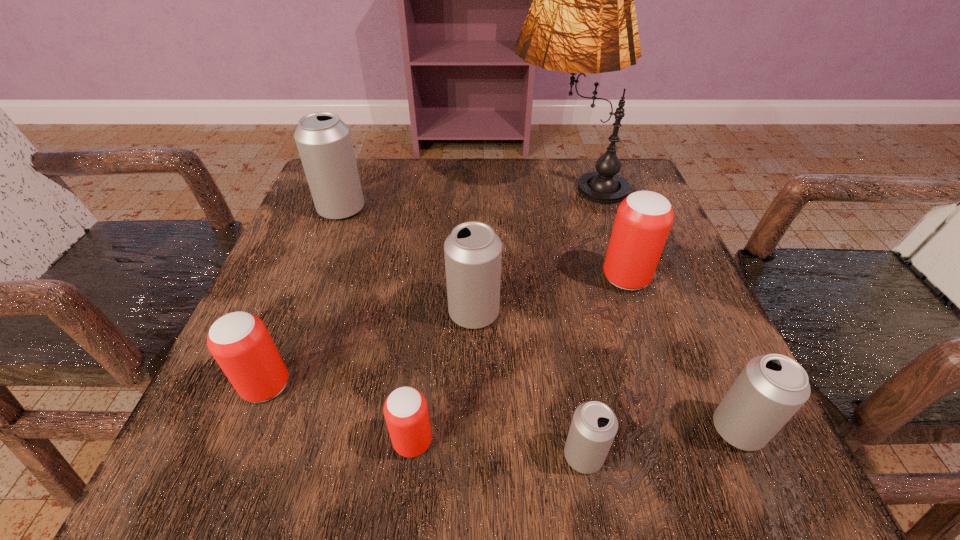
The image size is (960, 540). Find the location of `lampshade`. lampshade is located at coordinates (582, 19).

Where is `the seventh shortest object`? This screenshot has width=960, height=540. the seventh shortest object is located at coordinates (324, 143).

Identify the location of the leftmost white beer can. (324, 143).

I want to click on the farthest red beer can, so click(643, 220).

Identify the location of the second beer can from right to left. The height and width of the screenshot is (540, 960). (643, 220).

The image size is (960, 540). Identify the location of the fourth beer can from left to right. (473, 252).

Locate an element on the screen. The image size is (960, 540). the fourth object from left to right is located at coordinates (473, 252).

At what (x,y) coordinates should I click in order to perform the action: click on the second farthest red beer can. Please return your answer as a coordinate pair (x, y). This screenshot has width=960, height=540. Looking at the image, I should click on (239, 341).

Locate an element on the screen. The image size is (960, 540). the leftmost red beer can is located at coordinates (239, 341).

You are a GUI agent. You are given a task and a screenshot of the screen. Output one action in this format:
    pyautogui.click(x=<x>, y=<y>)
    Task: Click on the second smallest white beer can
    The height and width of the screenshot is (540, 960).
    Given the screenshot: What is the action you would take?
    pyautogui.click(x=771, y=388)